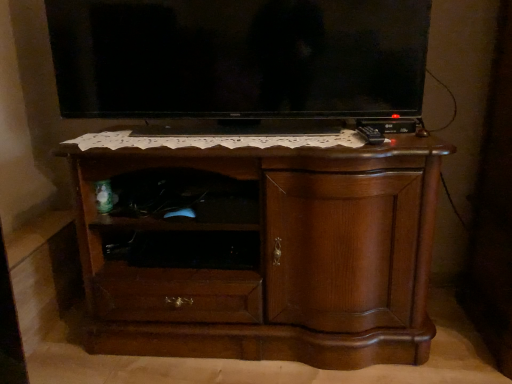
Question: Looking at the image, does black glossy tv at upper center seem bigger or smaller compared to black matte shelf at center?

Choices:
 (A) small
 (B) big

Answer: (B)

Question: Considering the positions of point (323, 110) and point (181, 233), is point (323, 110) closer or farther from the camera than point (181, 233)?

Choices:
 (A) farther
 (B) closer

Answer: (A)

Question: Which of these objects is positioned farthest from the brown wood chest of drawers at center?

Choices:
 (A) black matte shelf at center
 (B) black glossy tv at upper center

Answer: (B)

Question: Based on their relative distances, which object is nearer to the black matte shelf at center?

Choices:
 (A) black glossy tv at upper center
 (B) brown wood chest of drawers at center

Answer: (B)